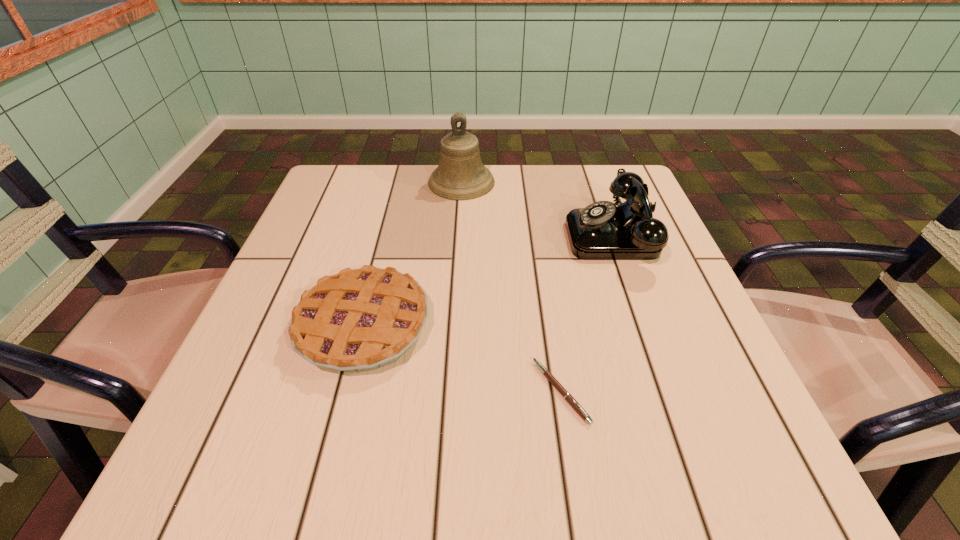
Locate an element on the screen. vacant space in between the bell and the rightmost object is located at coordinates (539, 208).

You are a GUI agent. You are given a task and a screenshot of the screen. Output one action in this format:
    pyautogui.click(x=<x>, y=<y>)
    Task: Click on the blank region between the farthest object and the second tallest object
    The height and width of the screenshot is (540, 960).
    Given the screenshot: What is the action you would take?
    pyautogui.click(x=539, y=208)

At what (x,y) coordinates should I click in order to perform the action: click on blank region between the bell and the second object from right to left. Please return your answer as a coordinate pair (x, y). Looking at the image, I should click on (511, 287).

Where is `vacant area between the rightmost object and the farthest object`? vacant area between the rightmost object and the farthest object is located at coordinates (539, 208).

Identify the location of vacant area that lies between the pie and the second farthest object. (490, 280).

Locate which object is the third closest to the pen. Please provide its 2D coordinates. Your answer should be formatted as a tuple, i.e. [(x, y)], where the tuple contains the x and y coordinates of a point satisfying the conditions above.

[(460, 175)]

Identify which object is the second nearest to the third tallest object. Please provide its 2D coordinates. Your answer should be formatted as a tuple, i.e. [(x, y)], where the tuple contains the x and y coordinates of a point satisfying the conditions above.

[(603, 230)]